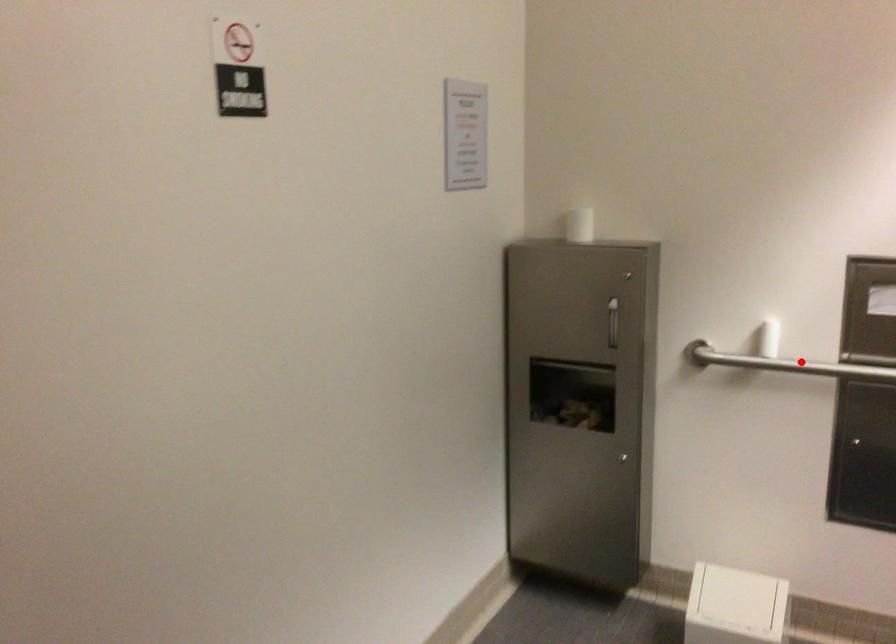
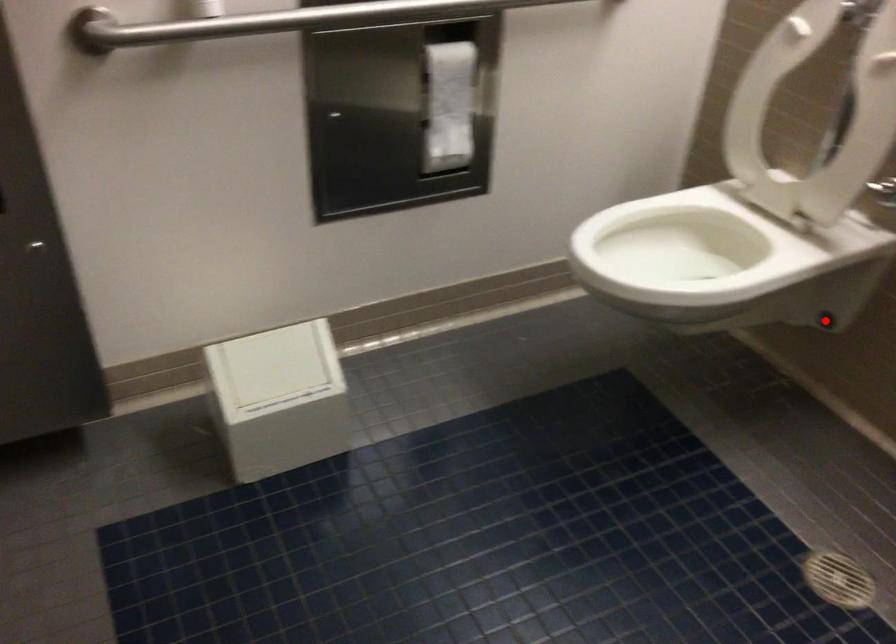
I am providing you with two images of the same scene from different viewpoints. A red point is marked on the first image and another point is marked on the second image. Is the red point in image1 aligned with the point shown in image2?

No